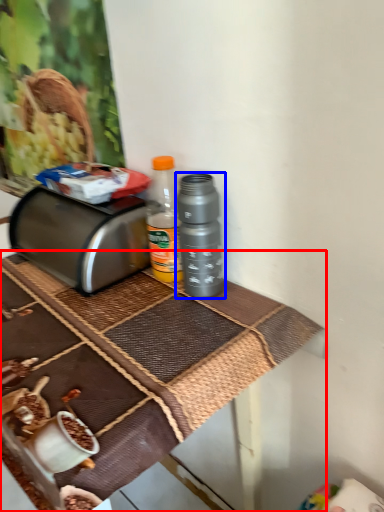
Question: Among these objects, which one is farthest to the camera, table (highlighted by a red box) or bottle (highlighted by a blue box)?

Choices:
 (A) table
 (B) bottle

Answer: (B)